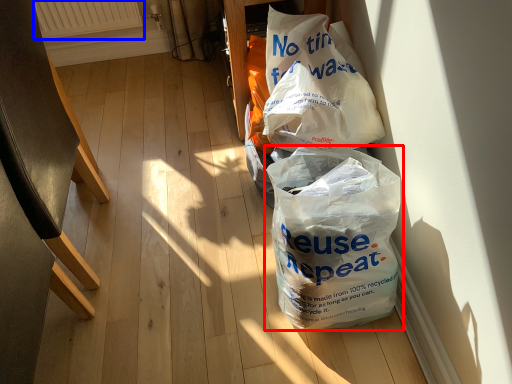
Question: Which object is further to the camera taking this photo, plastic bag (highlighted by a red box) or radiator (highlighted by a blue box)?

Choices:
 (A) plastic bag
 (B) radiator

Answer: (B)